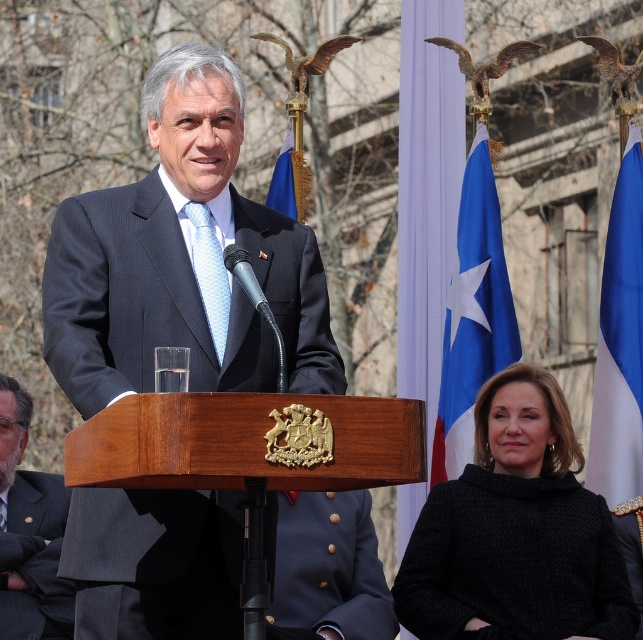
Can you confirm if navy blue fabric at lower center is positioned above light blue textured tie at center?

No.

Describe the element at coordinates (329, 566) in the screenshot. The height and width of the screenshot is (640, 643). I see `navy blue fabric at lower center` at that location.

Does point (284, 570) come behind point (203, 298)?

Yes.

Where is `navy blue fabric at lower center`? The width and height of the screenshot is (643, 640). navy blue fabric at lower center is located at coordinates (329, 566).

Can you confirm if white fabric flag at right is taller than light blue textured tie at center?

Correct, white fabric flag at right is much taller as light blue textured tie at center.

What do you see at coordinates (619, 340) in the screenshot? I see `white fabric flag at right` at bounding box center [619, 340].

Locate an element on the screen. white fabric flag at right is located at coordinates (619, 340).

The height and width of the screenshot is (640, 643). Identify the location of white fabric flag at right. tap(619, 340).

Does blue fabric flag at right lie in front of navy blue fabric at lower center?

No, it is not.

Between point (518, 355) and point (312, 547), which one is positioned in front?

Point (312, 547) is in front.

The image size is (643, 640). I want to click on blue fabric flag at right, so click(473, 312).